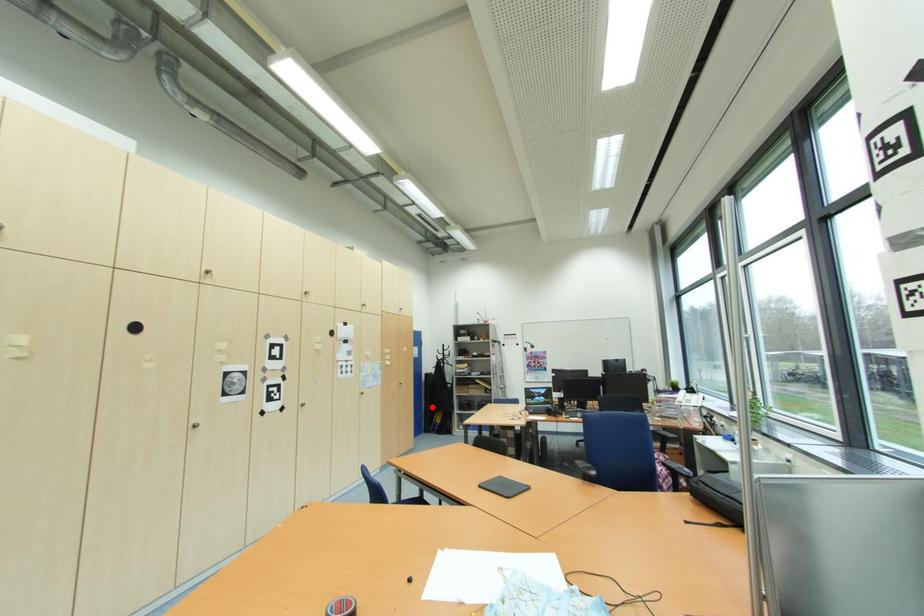
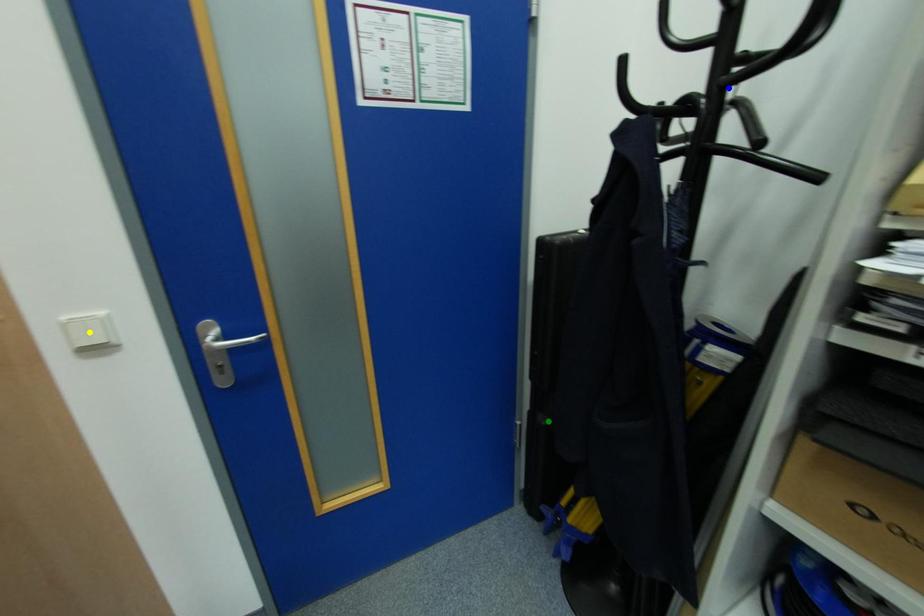
Question: I am providing you with two images of the same scene from different viewpoints. A red point is marked on the first image. You are given multiple points on the second image. Which spot in image 2 lines up with the point in image 1?

Choices:
 (A) blue point
 (B) yellow point
 (C) green point

Answer: (C)